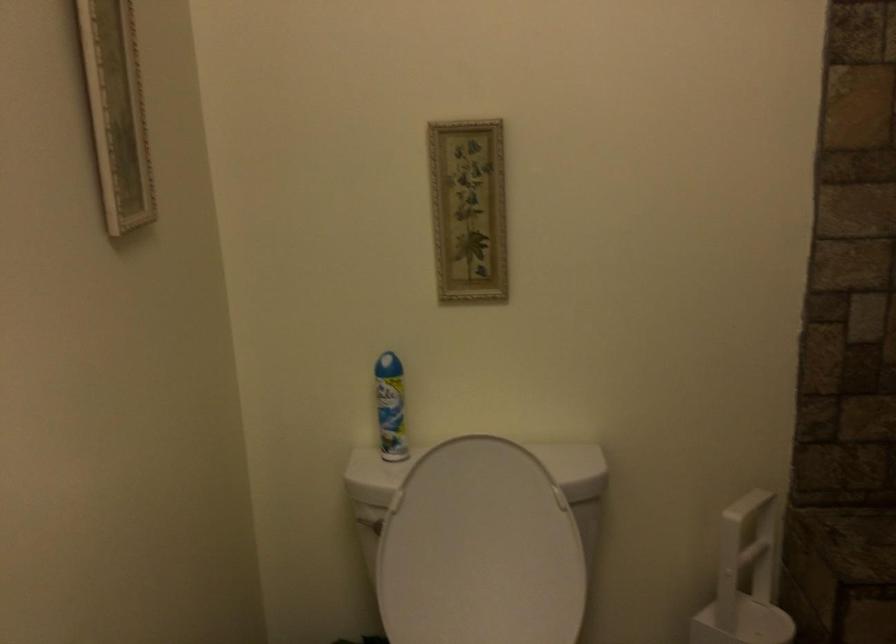
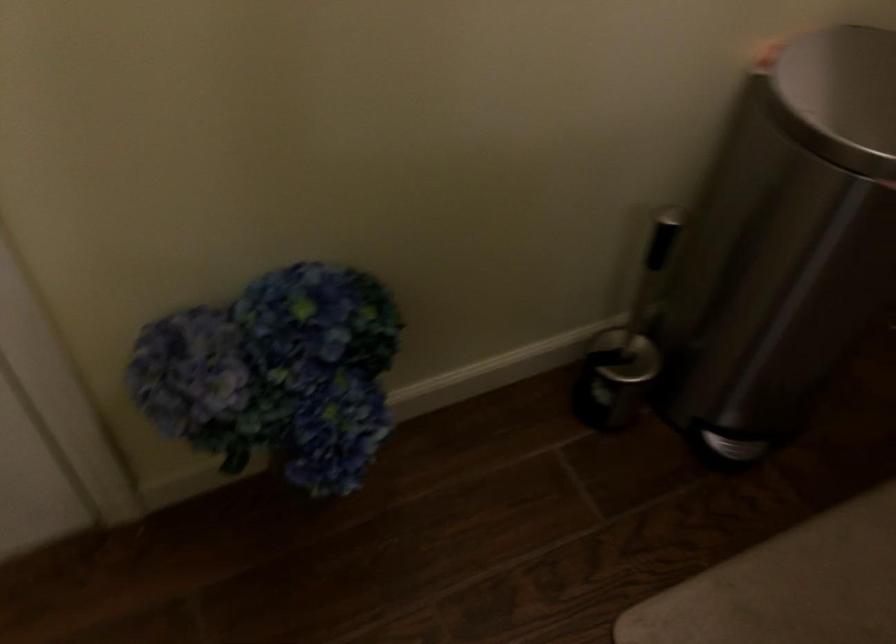
How did the camera likely rotate?

The camera rotated toward left-down.